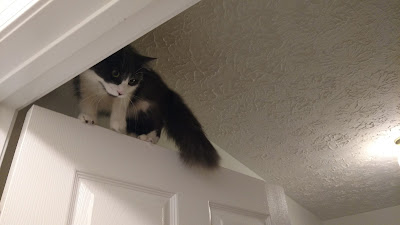
You are a GUI agent. You are given a task and a screenshot of the screen. Output one action in this format:
    pyautogui.click(x=<x>, y=<y>)
    Task: Click on the ceiling
    
    Given the screenshot: What is the action you would take?
    (262, 46)